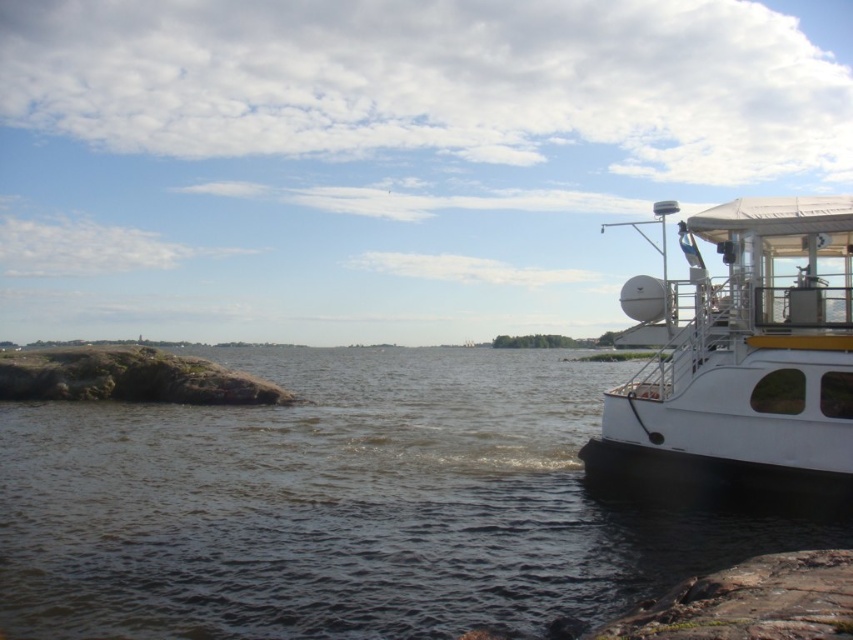
Can you confirm if brown water at lower left is thinner than white glossy boat at right?

Incorrect, brown water at lower left's width is not less than white glossy boat at right's.

Is point (480, 564) more distant than point (751, 433)?

No, it is not.

Between point (109, 433) and point (676, 372), which one is positioned in front?

Positioned in front is point (676, 372).

This screenshot has width=853, height=640. I want to click on brown water at lower left, so click(350, 506).